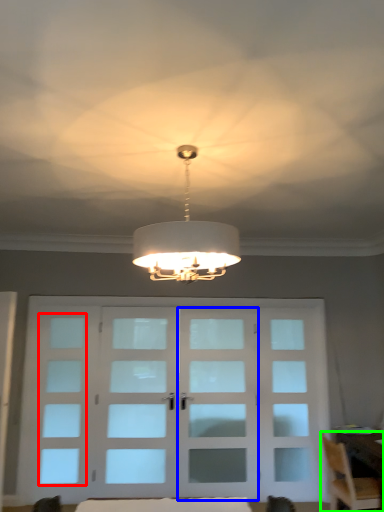
Question: Which object is positioned farthest from window (highlighted by a red box)? Select from screen door (highlighted by a blue box) and chair (highlighted by a green box).

Choices:
 (A) screen door
 (B) chair

Answer: (B)